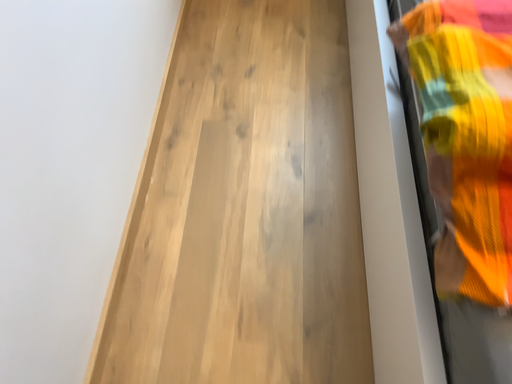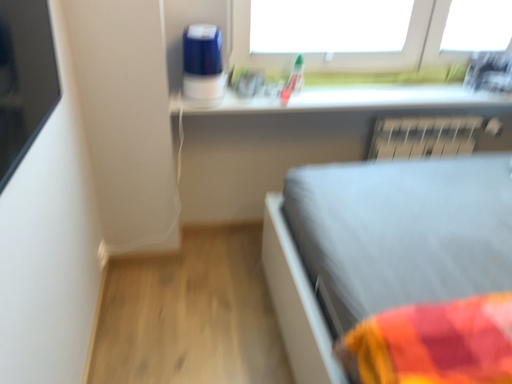
Question: Which way did the camera rotate in the video?

Choices:
 (A) rotated left
 (B) rotated right

Answer: (B)